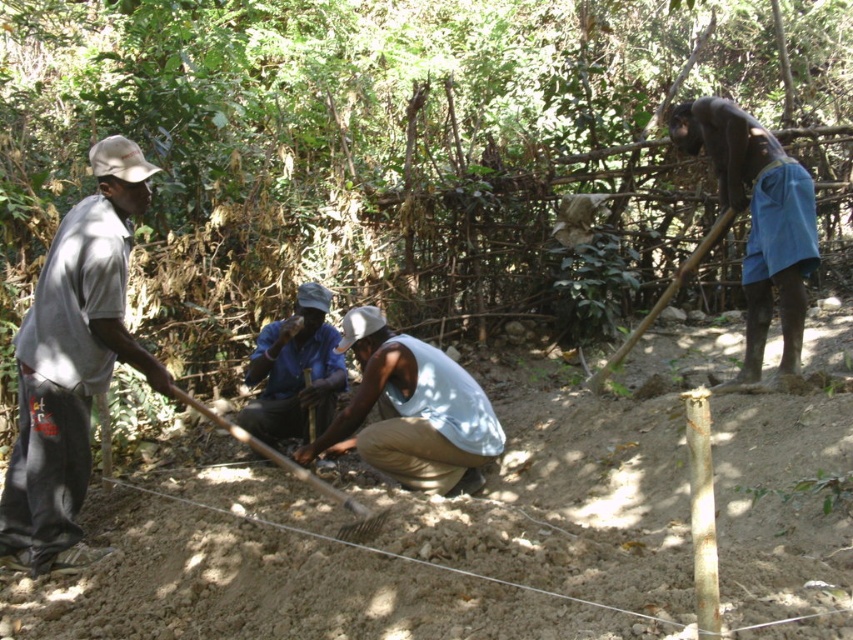
Question: From the image, what is the correct spatial relationship of wooden shovel at center in relation to wooden shovel at right?

Choices:
 (A) right
 (B) left

Answer: (B)

Question: Which object is positioned farthest from the wooden shovel at right?

Choices:
 (A) blue fabric shorts at right
 (B) wooden shovel at center
 (C) brown sandy soil at center

Answer: (B)

Question: Among these points, which one is nearest to the camera?

Choices:
 (A) (83, 440)
 (B) (236, 436)
 (C) (676, 285)
 (D) (300, 304)

Answer: (A)

Question: Which is nearer to the blue fabric shorts at right?

Choices:
 (A) wooden shovel at right
 (B) wooden shovel at center
 (C) light blue sleeveless shirt at center
 (D) gray cotton shirt at left

Answer: (A)

Question: Is blue fabric shorts at right to the right of wooden shovel at center from the viewer's perspective?

Choices:
 (A) yes
 (B) no

Answer: (A)

Question: Observing the image, what is the correct spatial positioning of brown sandy soil at center in reference to gray cotton shirt at left?

Choices:
 (A) left
 (B) right

Answer: (B)